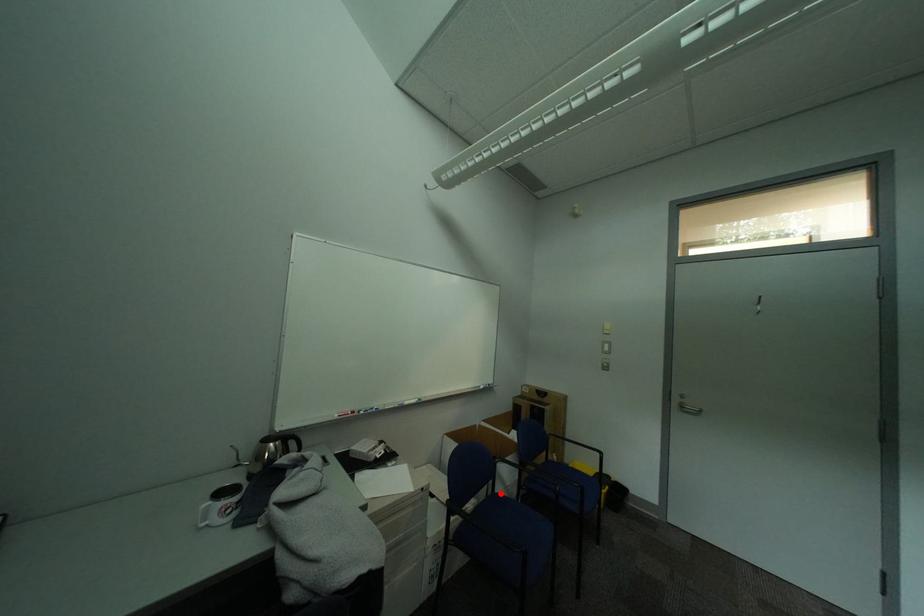
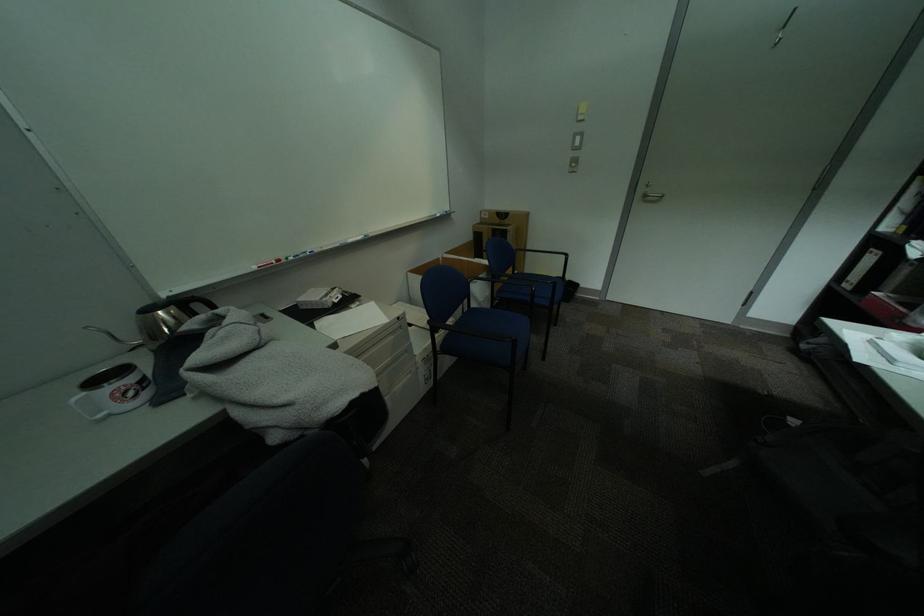
Question: I am providing you with two images of the same scene from different viewpoints. In image1, a red point is highlighted. Considering the same 3D point in image2, which of the following is correct?

Choices:
 (A) It is closer
 (B) It is farther

Answer: (A)